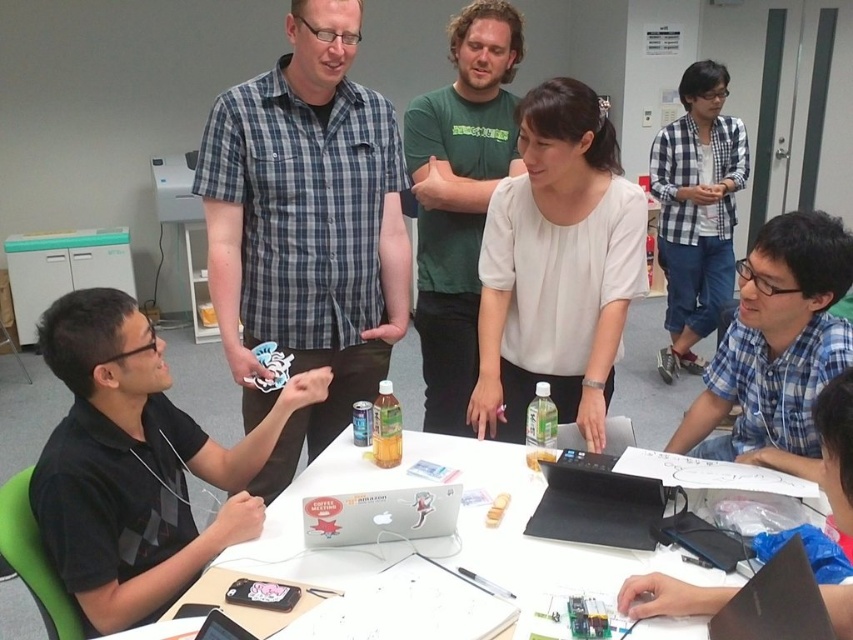
You are a photographer standing behind the group at the table. You need to take a photo of the white paper at center without the green cotton shirt at center blocking it. How should you adjust your position or angle?

The green cotton shirt at center is located above the white paper at center. To avoid blocking the white paper at center, you should lower your camera angle or move to a position where the green cotton shirt at center is no longer in front of the white paper at center.

Looking at this image, where is the plaid shirt at center located in the image?

The plaid shirt at center is located at point (306, 228).

You are a photographer positioned at the back of the room. You want to take a photo of both the blue plaid shirt at center and the blue plaid shirt at lower right. Which shirt should you focus on first to ensure both are in the frame?

You should focus on the blue plaid shirt at center first because it is much taller than the blue plaid shirt at lower right, so it will be easier to frame both by starting with the taller one.